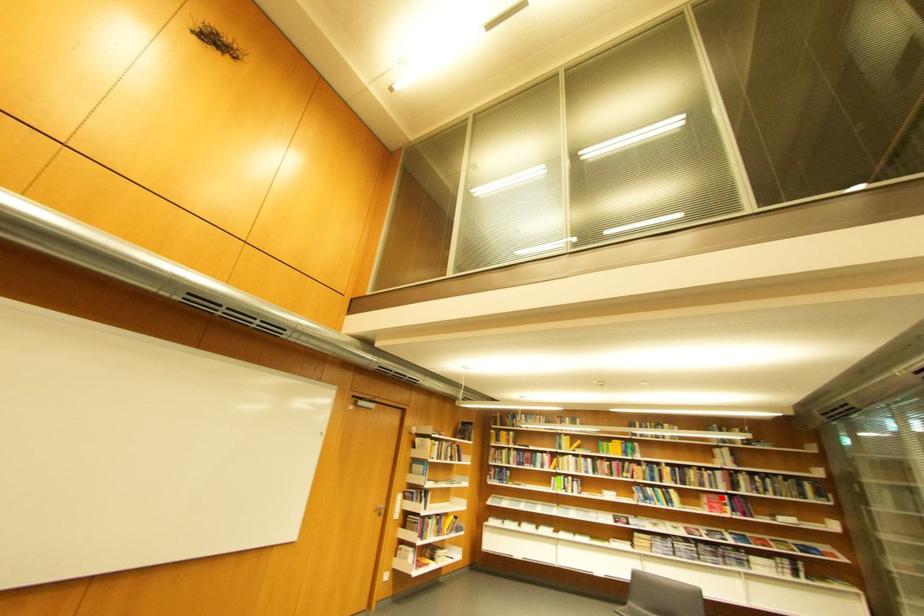
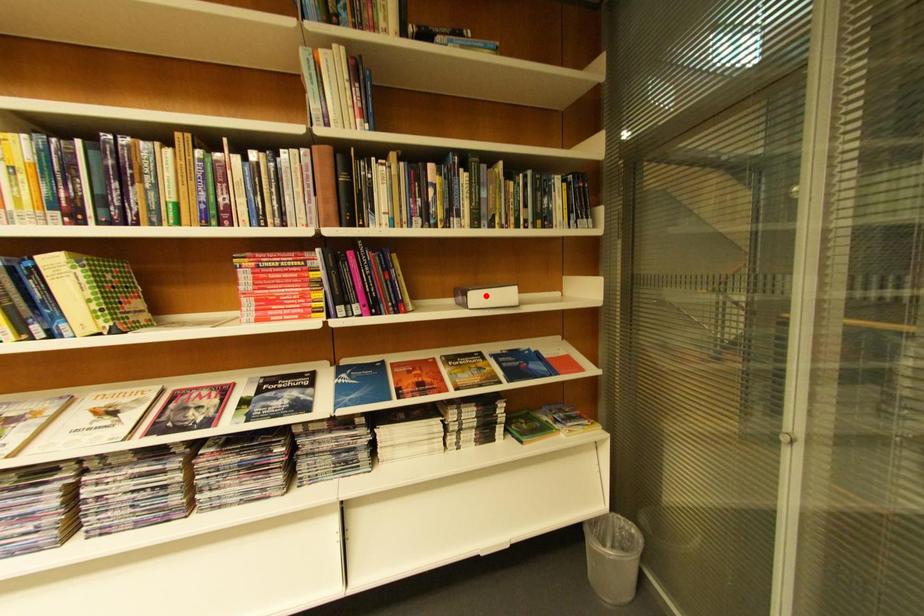
I am providing you with two images of the same scene from different viewpoints. A red point is marked on the first image and another point is marked on the second image. Does the point marked in image1 correspond to the same location as the one in image2?

No